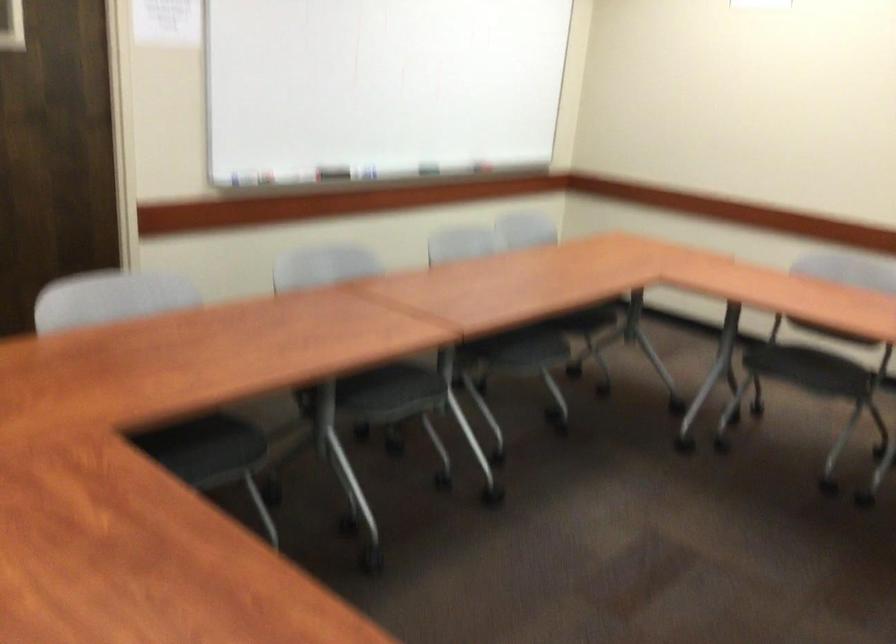
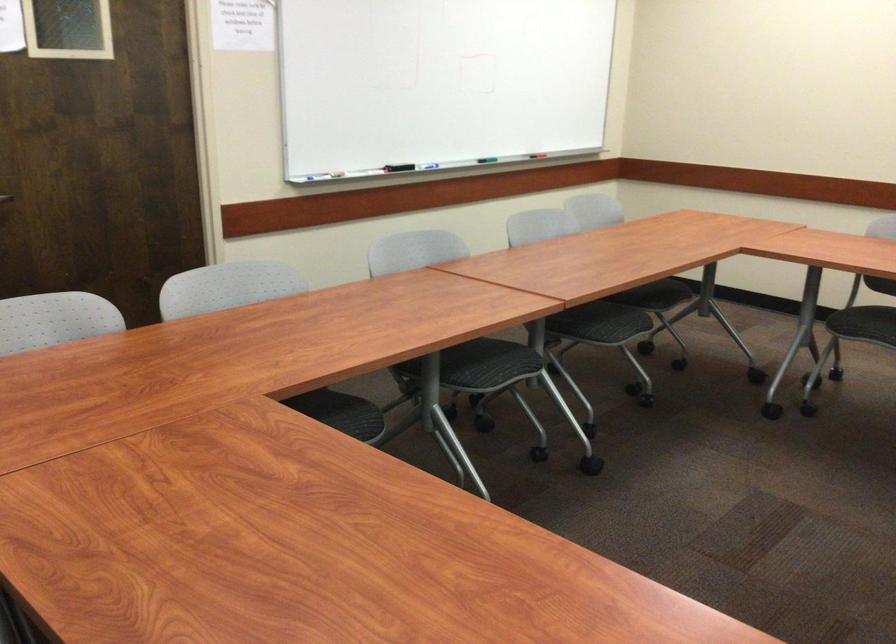
Locate, in the second image, the point that corresponds to point (149, 351) in the first image.

(265, 330)